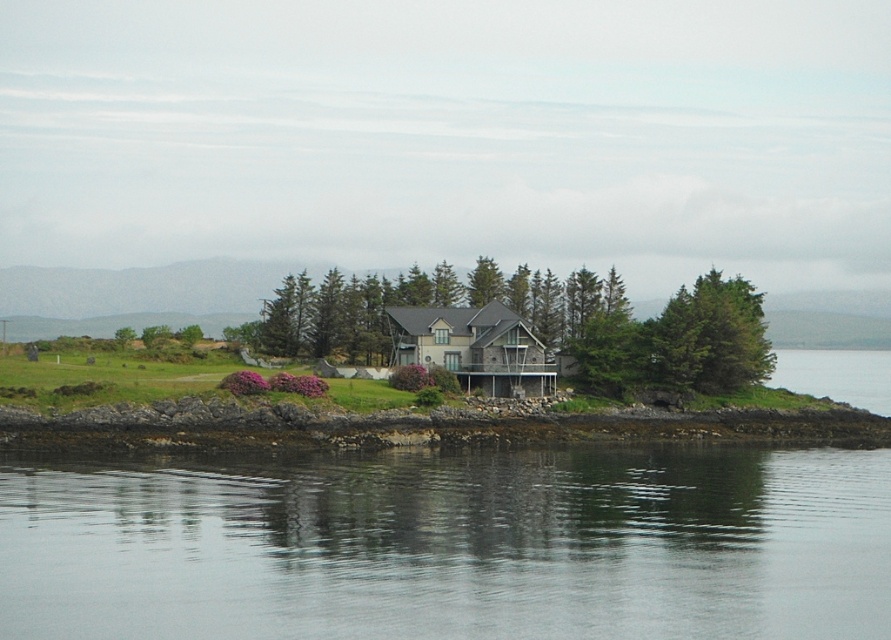
You are standing at the rugged stone shoreline at lower left and want to reach the green textured house at center. Which direction should you walk to get there?

You should walk to the right because the green textured house at center is located to the left of the rugged stone shoreline at lower left, so moving right from the shoreline will lead towards the house.

Based on the photo, you are a delivery drone with a maximum flight range of 16 meters. You need to deliver a package to the green textured house at center from the rugged stone shoreline at lower left. Can you complete the delivery without needing to recharge?

The distance between the green textured house at center and the rugged stone shoreline at lower left is 15.88 meters, which is within your 16 meter flight range. Yes, you can complete the delivery without needing to recharge.